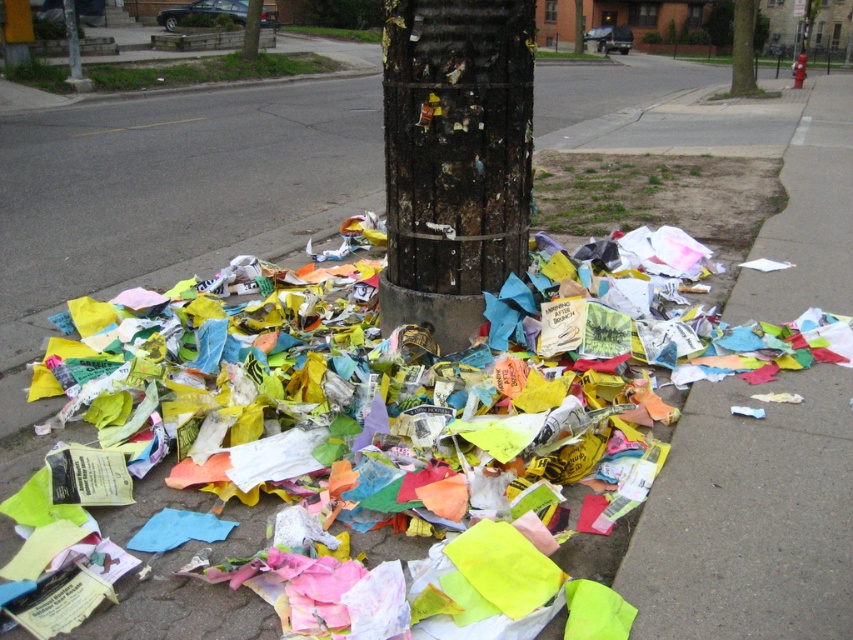
You are standing at the point marked by the coordinates [270,403]. Looking around, you see multicolored paper at center. Which direction should you move to reach the tree trunk?

The point marked by the coordinates [270,403] is already at the multicolored paper at center, which is near the base of the tree trunk. Therefore, you are already close to the tree trunk and do not need to move further.

You are a street cleaner who needs to collect the multicolored paper at center and the charred wood post at center. Which object should you pick up first if you want to handle the larger item first?

The multicolored paper at center has a larger size compared to the charred wood post at center, so you should pick up the multicolored paper at center first.

You are standing in front of the tree with scattered papers. You notice two points marked on the ground near the tree trunk. The first point is at coordinates point (x=210, y=365) and the second point is at point (x=492, y=262). If you want to pick up an object near the first point, which direction should you move relative to the second point?

Since point (x=210, y=365) is closer to the camera than point (x=492, y=262), you should move towards the direction of the first point which is nearer to you compared to the second point.